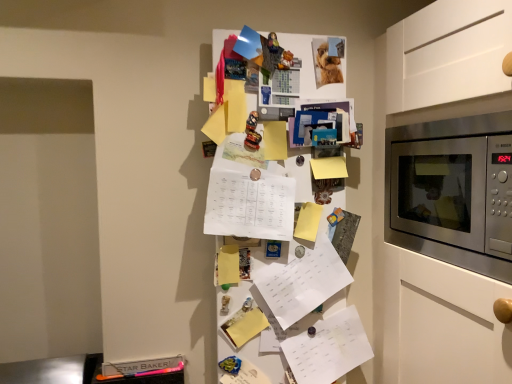
Question: Can you see white paper at center, arranged as the 2th list when ordered from the bottom, touching white paper at center, the third list positioned from the bottom?

Choices:
 (A) no
 (B) yes

Answer: (A)

Question: From a real-world perspective, is white paper at center, the 2th list positioned from the top, located beneath white paper at center, the third list positioned from the bottom?

Choices:
 (A) no
 (B) yes

Answer: (B)

Question: Considering the relative sizes of white paper at center, the 2th list positioned from the top, and white paper at center, acting as the 1th list starting from the top, in the image provided, is white paper at center, the 2th list positioned from the top, shorter than white paper at center, acting as the 1th list starting from the top,?

Choices:
 (A) no
 (B) yes

Answer: (A)

Question: Is white paper at center, the 2th list positioned from the top, facing towards white paper at center, acting as the 1th list starting from the top?

Choices:
 (A) no
 (B) yes

Answer: (A)

Question: Considering the relative sizes of white paper at center, the 2th list positioned from the top, and white paper at center, acting as the 1th list starting from the top, in the image provided, is white paper at center, the 2th list positioned from the top, smaller than white paper at center, acting as the 1th list starting from the top,?

Choices:
 (A) yes
 (B) no

Answer: (A)

Question: Is white paper at center, arranged as the 2th list when ordered from the bottom, positioned in front of white paper at center, acting as the 1th list starting from the top?

Choices:
 (A) yes
 (B) no

Answer: (B)

Question: Would you say stainless steel microwave at right is a long distance from white paper at center, the 2th list positioned from the top?

Choices:
 (A) no
 (B) yes

Answer: (A)

Question: Considering the relative sizes of stainless steel microwave at right and white paper at center, the 2th list positioned from the top, in the image provided, is stainless steel microwave at right bigger than white paper at center, the 2th list positioned from the top,?

Choices:
 (A) no
 (B) yes

Answer: (B)

Question: From a real-world perspective, is stainless steel microwave at right on top of white paper at center, arranged as the 2th list when ordered from the bottom?

Choices:
 (A) no
 (B) yes

Answer: (B)

Question: Is stainless steel microwave at right oriented towards white paper at center, the 2th list positioned from the top?

Choices:
 (A) yes
 (B) no

Answer: (B)

Question: From a real-world perspective, is stainless steel microwave at right located beneath white paper at center, arranged as the 2th list when ordered from the bottom?

Choices:
 (A) no
 (B) yes

Answer: (A)

Question: Is stainless steel microwave at right positioned before white paper at center, arranged as the 2th list when ordered from the bottom?

Choices:
 (A) yes
 (B) no

Answer: (A)

Question: Can you confirm if white paper at center, acting as the 1th list starting from the top, is smaller than white paper at center, which is counted as the first list, starting from the bottom?

Choices:
 (A) yes
 (B) no

Answer: (B)